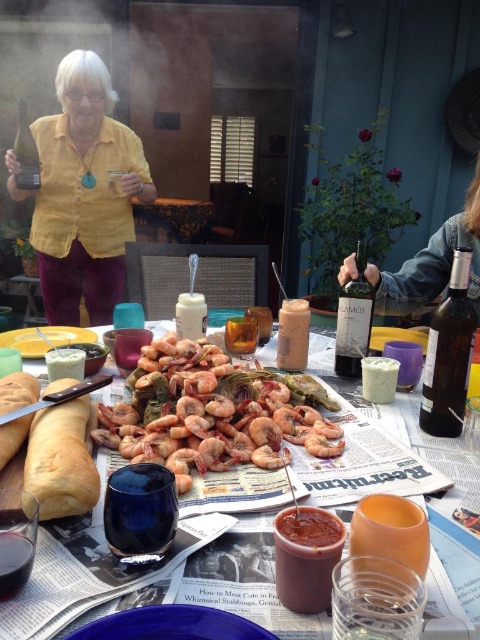
Can you confirm if denim jacket at right is smaller than translucent glass bottle at center?

No, denim jacket at right is not smaller than translucent glass bottle at center.

Measure the distance between denim jacket at right and translucent glass bottle at center.

denim jacket at right and translucent glass bottle at center are 6.13 inches apart from each other.

Identify the location of denim jacket at right. The image size is (480, 640). (432, 262).

Which is above, yellow button-down shirt at upper left or shiny silver knife at center?

yellow button-down shirt at upper left is above.

Which is more to the right, yellow button-down shirt at upper left or shiny silver knife at center?

shiny silver knife at center is more to the right.

Which is behind, point (93, 243) or point (182, 522)?

Point (93, 243)

You are a GUI agent. You are given a task and a screenshot of the screen. Output one action in this format:
    pyautogui.click(x=<x>, y=<y>)
    Task: Click on the yellow button-down shirt at upper left
    
    Given the screenshot: What is the action you would take?
    pyautogui.click(x=83, y=193)

Consider the image. Is yellow button-down shirt at upper left thinner than wooden table at center?

Correct, yellow button-down shirt at upper left's width is less than wooden table at center's.

Which is in front, point (79, 243) or point (192, 241)?

Point (79, 243) is in front.

Is point (41, 276) in front of point (196, 227)?

That is True.

The image size is (480, 640). What are the coordinates of `yellow button-down shirt at upper left` in the screenshot? It's located at (83, 193).